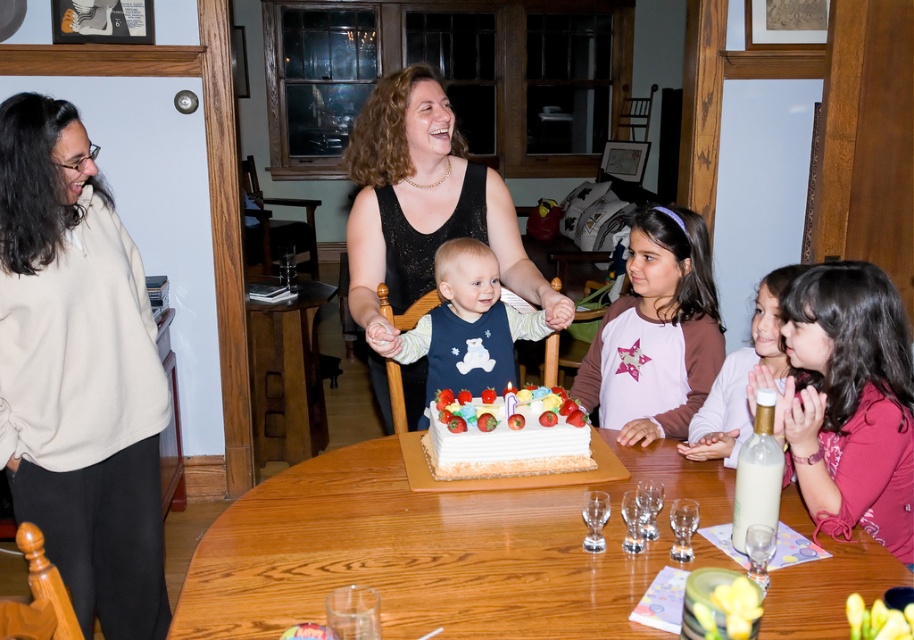
Is pink satin dress at lower right taller than white frosted cake at center?

Yes, pink satin dress at lower right is taller than white frosted cake at center.

Is pink satin dress at lower right in front of white frosted cake at center?

Yes, pink satin dress at lower right is in front of white frosted cake at center.

Does point (885, 464) lie in front of point (571, 426)?

Yes.

The height and width of the screenshot is (640, 914). In order to click on pink satin dress at lower right in this screenshot , I will do `click(849, 401)`.

Which is above, pink satin dress at lower right or matte blue bib at center?

matte blue bib at center is higher up.

Which is more to the left, pink satin dress at lower right or matte blue bib at center?

Positioned to the left is matte blue bib at center.

What do you see at coordinates (849, 401) in the screenshot? Image resolution: width=914 pixels, height=640 pixels. I see `pink satin dress at lower right` at bounding box center [849, 401].

Find the location of a particular element. pink satin dress at lower right is located at coordinates (849, 401).

Consider the image. Is brown wooden table at center to the right of white frosted cake at center from the viewer's perspective?

In fact, brown wooden table at center is to the left of white frosted cake at center.

Measure the distance between brown wooden table at center and camera.

They are 3.26 meters apart.

Is point (309, 420) behind point (581, 467)?

Yes, it is behind point (581, 467).

Identify the location of brown wooden table at center. (285, 376).